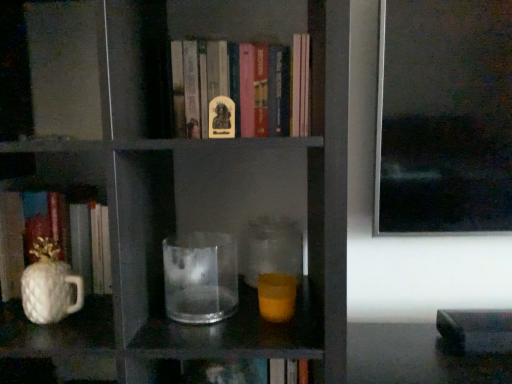
Question: Is transparent glass at center with transparent glass jar at center?

Choices:
 (A) yes
 (B) no

Answer: (B)

Question: Considering the relative sizes of transparent glass at center and transparent glass jar at center in the image provided, is transparent glass at center wider than transparent glass jar at center?

Choices:
 (A) yes
 (B) no

Answer: (A)

Question: From a real-world perspective, is transparent glass at center under transparent glass jar at center?

Choices:
 (A) no
 (B) yes

Answer: (A)

Question: From a real-world perspective, is transparent glass at center over transparent glass jar at center?

Choices:
 (A) no
 (B) yes

Answer: (B)

Question: Is transparent glass at center outside of transparent glass jar at center?

Choices:
 (A) no
 (B) yes

Answer: (B)

Question: Relative to white glossy pineapple-shaped mug at left, is translucent glass candle at center in front or behind?

Choices:
 (A) front
 (B) behind

Answer: (B)

Question: Is point (289, 309) closer or farther from the camera than point (27, 291)?

Choices:
 (A) farther
 (B) closer

Answer: (B)

Question: From the image's perspective, is translucent glass candle at center located above or below white glossy pineapple-shaped mug at left?

Choices:
 (A) above
 (B) below

Answer: (B)

Question: Is translucent glass candle at center inside the boundaries of white glossy pineapple-shaped mug at left, or outside?

Choices:
 (A) inside
 (B) outside

Answer: (B)

Question: Choose the correct answer: Is white glossy pineapple-shaped mug at left inside transparent glass at center or outside it?

Choices:
 (A) outside
 (B) inside

Answer: (A)

Question: Is white glossy pineapple-shaped mug at left in front of or behind transparent glass at center in the image?

Choices:
 (A) front
 (B) behind

Answer: (B)

Question: Is point (46, 274) positioned closer to the camera than point (203, 311)?

Choices:
 (A) closer
 (B) farther

Answer: (A)

Question: From the image's perspective, relative to transparent glass at center, is white glossy pineapple-shaped mug at left above or below?

Choices:
 (A) below
 (B) above

Answer: (A)

Question: Is point (10, 271) closer or farther from the camera than point (262, 281)?

Choices:
 (A) closer
 (B) farther

Answer: (B)

Question: Choose the correct answer: Is white glossy pineapple-shaped object at left, marked as the first book in a bottom-to-top arrangement, inside translucent glass candle at center or outside it?

Choices:
 (A) outside
 (B) inside

Answer: (A)